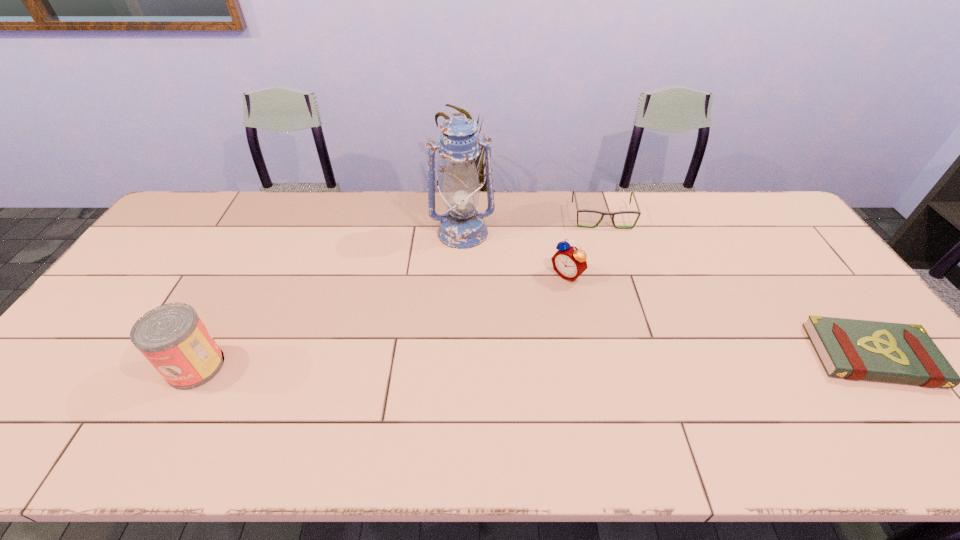
Locate an element on the screen. The image size is (960, 540). empty space between the lantern and the leftmost object is located at coordinates (329, 299).

This screenshot has height=540, width=960. I want to click on the closest object to the leftmost object, so click(462, 227).

Locate an element on the screen. Image resolution: width=960 pixels, height=540 pixels. object that is the second nearest to the third object from right to left is located at coordinates tap(462, 227).

Find the location of `vacant space that satisfies the following two spatial constraints: 1. on the front side of the third nearest object; 2. on the right side of the fourth object from right to left`. vacant space that satisfies the following two spatial constraints: 1. on the front side of the third nearest object; 2. on the right side of the fourth object from right to left is located at coordinates (461, 275).